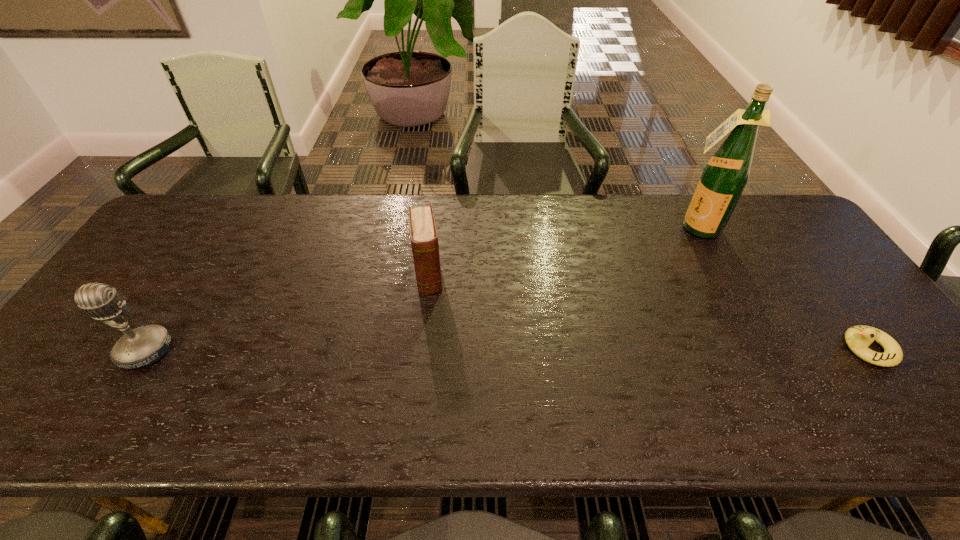
Locate an element on the screen. The width and height of the screenshot is (960, 540). free space located 0.130m on the face of the rightmost object is located at coordinates (787, 349).

I want to click on free space located on the front-facing side of the second object from right to left, so click(660, 267).

At what (x,y) coordinates should I click in order to perform the action: click on vacant space located 0.120m on the front-facing side of the second object from right to left. Please return your answer as a coordinate pair (x, y). Looking at the image, I should click on (667, 258).

Image resolution: width=960 pixels, height=540 pixels. What are the coordinates of `vacant space located 0.210m on the front-facing side of the second object from right to left` in the screenshot? It's located at (654, 275).

What are the coordinates of `free spot located 0.130m on the spine side of the diary` in the screenshot? It's located at (433, 335).

The width and height of the screenshot is (960, 540). Identify the location of vacant space situated 0.090m on the spine side of the diary. (432, 322).

The image size is (960, 540). I want to click on vacant space located 0.140m on the spine side of the diary, so click(x=434, y=339).

The width and height of the screenshot is (960, 540). I want to click on object that is at the far edge, so click(x=725, y=176).

Find the location of a particular element. microphone located in the near edge section of the desktop is located at coordinates (143, 346).

You are a GUI agent. You are given a task and a screenshot of the screen. Output one action in this format:
    pyautogui.click(x=<x>, y=<y>)
    Task: Click on the duckling present at the near edge
    Image resolution: width=960 pixels, height=540 pixels.
    Given the screenshot: What is the action you would take?
    pyautogui.click(x=858, y=338)